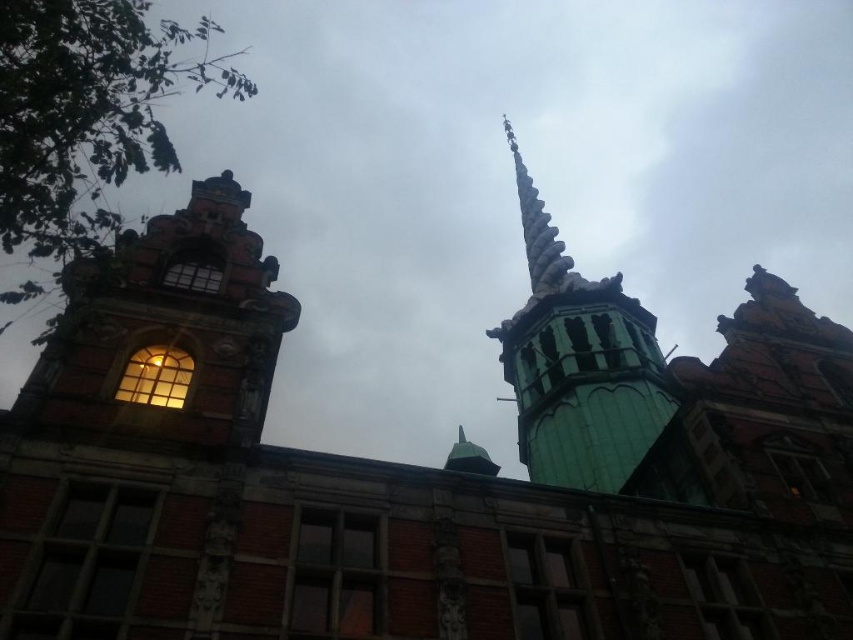
You are standing in front of the historic building and want to take a photo of the cloudy sky at upper center. According to the coordinates provided, where exactly should you aim your camera?

The cloudy sky at upper center is located at point coordinates 0.286 on the x and 0.599 on the y axis. You should aim your camera at those coordinates to capture it.

You are standing in front of the historic building and want to take a photo of the green glazed tile spire at upper center. Based on its position, where should you aim your camera to capture it in the frame?

The green glazed tile spire at upper center is located at point (x=578, y=364), so you should aim your camera at those coordinates to capture it in the frame.

Looking at the historic building with its Gothic Revival architecture, you notice the cloudy sky at upper center and the gray stone spire at upper center. Which of these two elements takes up more space in the image?

The cloudy sky at upper center is larger in size than the gray stone spire at upper center, so it occupies more space in the image.